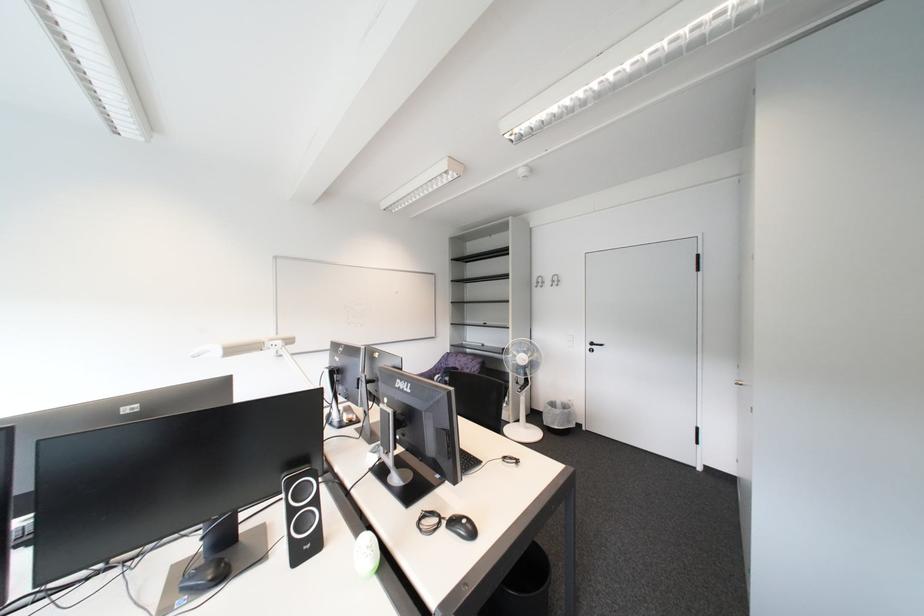
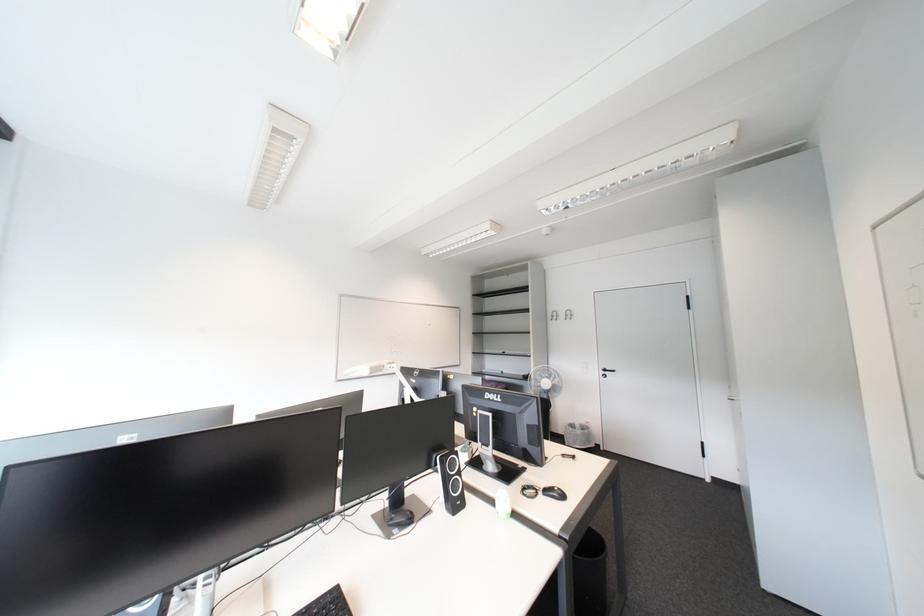
Which direction would the cameraman need to move to produce the second image?

The cameraman walked toward left, backward.